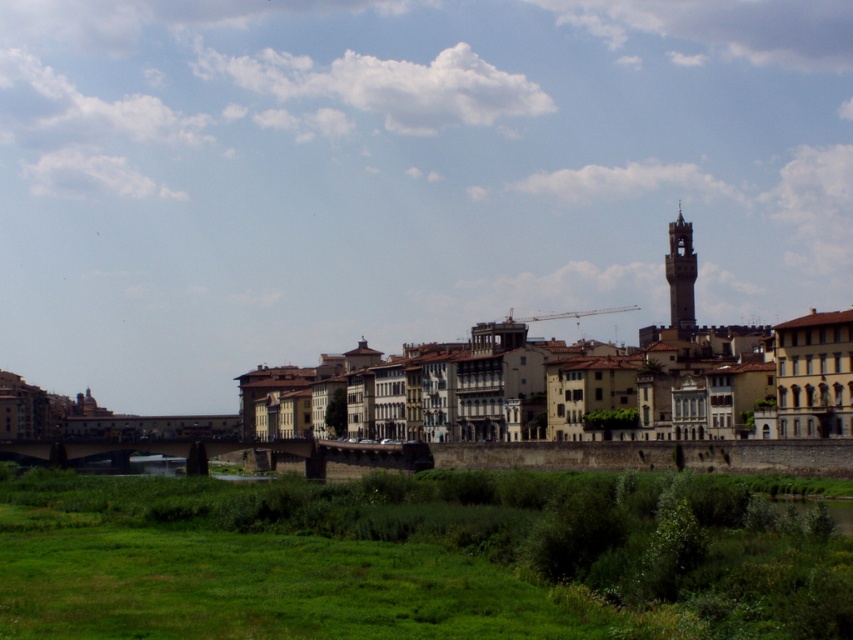
You are standing at the edge of the city park and want to walk to the stone bridge in the middle ground. The green grassy area at lower center is directly between you and the bridge. If you walk straight towards the bridge, will you step on the green grassy at lower center?

The green grassy at lower center and viewer are 62.03 meters apart from each other. Since the grassy area is between you and the bridge, walking straight towards the bridge would require stepping on the green grassy at lower center.

You are a drone operator who needs to fly a drone from the green grassy at lower center to the dark gray stone clock tower at upper right. What is the minimum distance you need to cover?

The minimum distance between the green grassy at lower center and the dark gray stone clock tower at upper right is 70.40 meters.